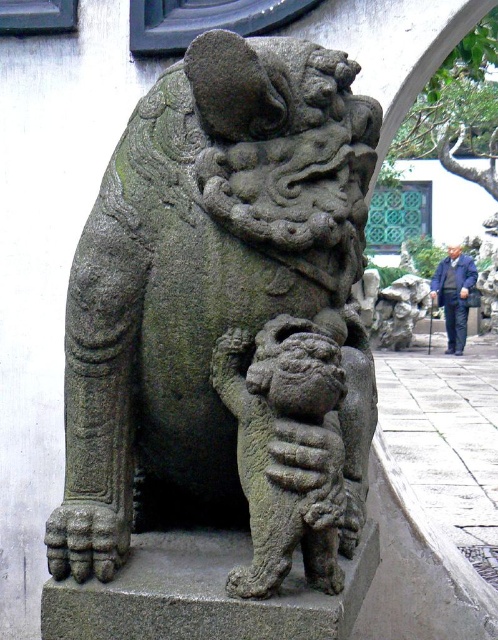
Can you confirm if gray stone lion at center is smaller than granite stone lion cub at lower center?

Incorrect, gray stone lion at center is not smaller in size than granite stone lion cub at lower center.

Does point (185, 422) come farther from viewer compared to point (313, 572)?

Yes, point (185, 422) is farther from viewer.

Does point (81, 326) lie behind point (237, 387)?

Yes, it is behind point (237, 387).

Identify the location of gray stone lion at center. (225, 316).